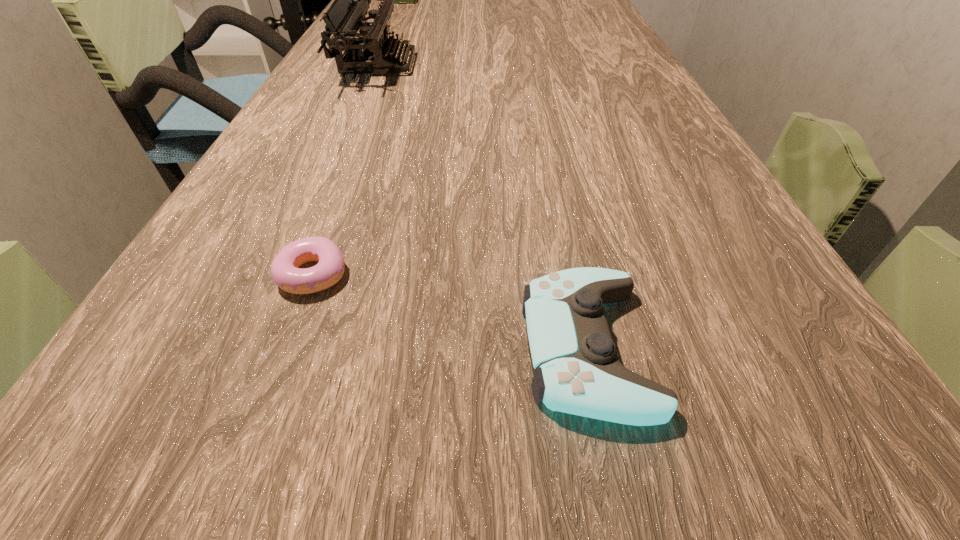
You are a GUI agent. You are given a task and a screenshot of the screen. Output one action in this format:
    pyautogui.click(x=<x>, y=<y>)
    Task: Click on the free space at the far edge of the desktop
    The image size is (960, 540).
    Given the screenshot: What is the action you would take?
    pyautogui.click(x=472, y=9)

I want to click on free space at the left edge of the desktop, so click(279, 164).

The image size is (960, 540). What are the coordinates of `vacant area at the right edge of the desktop` in the screenshot? It's located at (625, 104).

Identify the location of unoccupied position between the third nearest object and the shortest object. This screenshot has height=540, width=960. (346, 170).

Where is `free point between the doughnut and the second shortest object`? This screenshot has width=960, height=540. free point between the doughnut and the second shortest object is located at coordinates (450, 311).

Where is `unoccupied position between the shortest object and the control`? unoccupied position between the shortest object and the control is located at coordinates (450, 311).

Point out which object is positioned as the second nearest to the farthest object. Please provide its 2D coordinates. Your answer should be formatted as a tuple, i.e. [(x, y)], where the tuple contains the x and y coordinates of a point satisfying the conditions above.

[(285, 271)]

Locate an element on the screen. This screenshot has height=540, width=960. object that is the second closest to the microscope is located at coordinates (285, 271).

This screenshot has height=540, width=960. Identify the location of vacant space that satisfies the following two spatial constraints: 1. on the back side of the shortest object; 2. on the typing side of the typewriter. (390, 65).

In order to click on vacant area in the image that satisfies the following two spatial constraints: 1. on the back side of the third tallest object; 2. on the typing side of the third shortest object in this screenshot , I will do `click(530, 65)`.